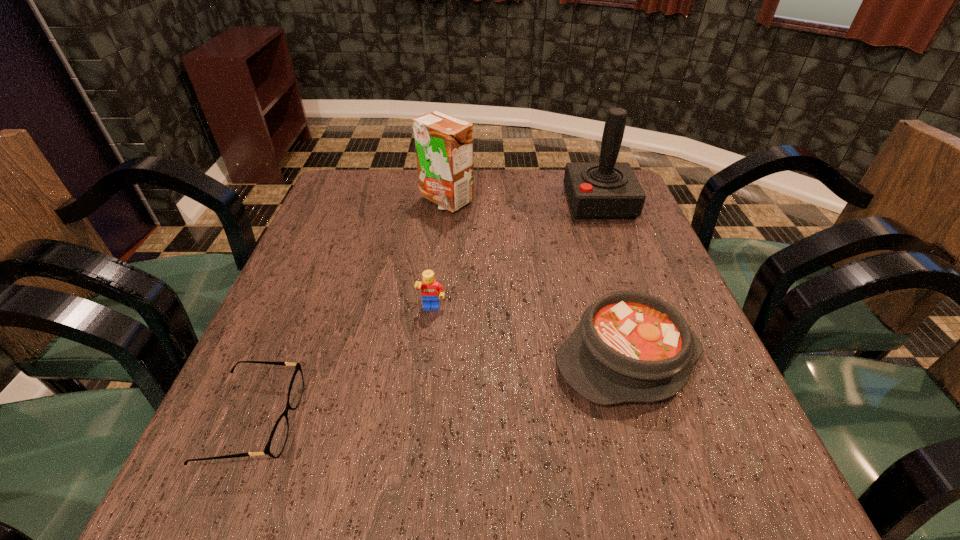
The image size is (960, 540). Identify the location of joystick. (607, 189).

You are a GUI agent. You are given a task and a screenshot of the screen. Output one action in this format:
    pyautogui.click(x=<x>, y=<y>)
    Task: Click on the carton
    The height and width of the screenshot is (540, 960).
    Given the screenshot: What is the action you would take?
    pyautogui.click(x=444, y=144)

This screenshot has width=960, height=540. What are the coordinates of `Lego` in the screenshot? It's located at (431, 290).

Where is `casserole`? The width and height of the screenshot is (960, 540). casserole is located at coordinates (629, 346).

Where is `spectacles`? This screenshot has height=540, width=960. spectacles is located at coordinates (277, 440).

In order to click on the shortest object in this screenshot , I will do `click(277, 440)`.

The height and width of the screenshot is (540, 960). What are the coordinates of `free space located 0.080m on the base of the joystick` in the screenshot? It's located at (538, 203).

At what (x,y) coordinates should I click in order to perform the action: click on vacant area located 0.100m on the base of the joystick. Please return your answer as a coordinate pair (x, y). Looking at the image, I should click on (530, 203).

Identify the location of blank space located on the base of the joystick. The width and height of the screenshot is (960, 540). (508, 203).

Locate an element on the screen. vacant space located on the straw side of the carton is located at coordinates (442, 243).